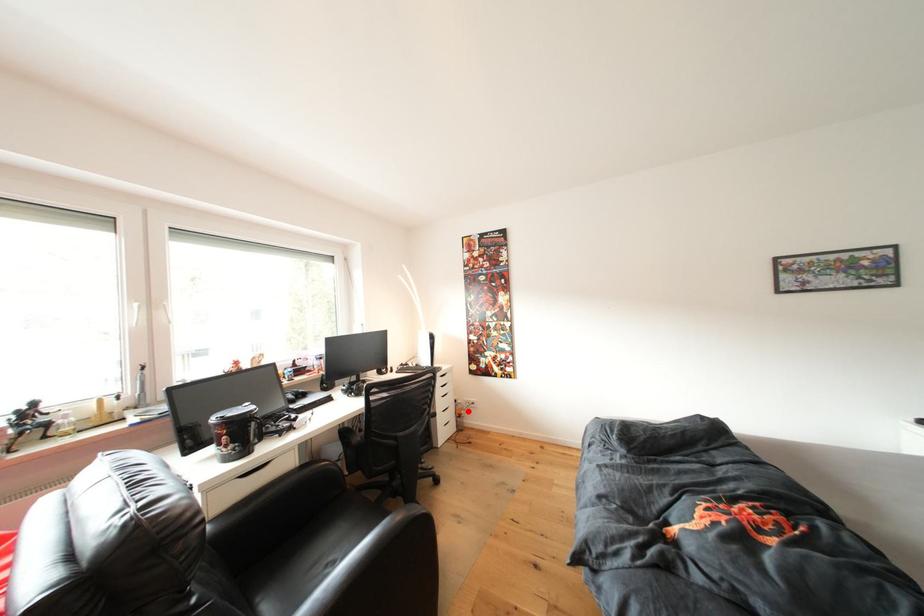
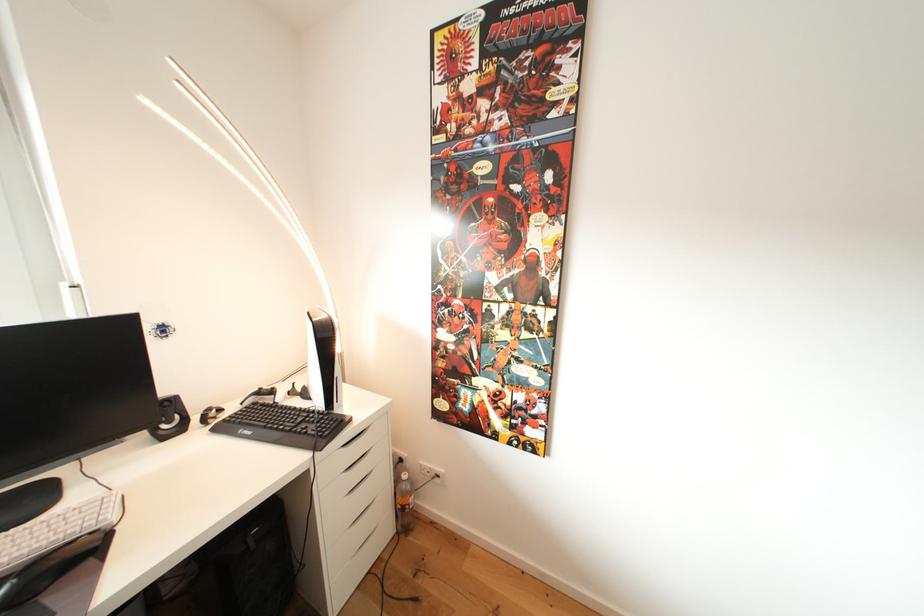
Question: I am providing you with two images of the same scene from different viewpoints. A red point is shown in image1. For the corresponding object point in image2, is it positioned nearer or farther from the camera?

Choices:
 (A) Nearer
 (B) Farther

Answer: (A)